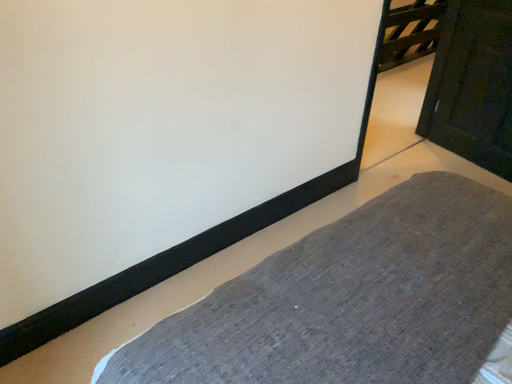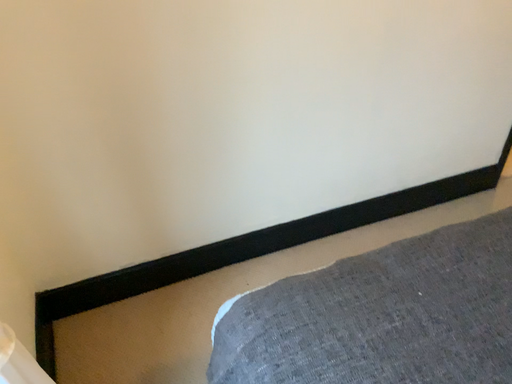
Question: How did the camera likely rotate when shooting the video?

Choices:
 (A) rotated right
 (B) rotated left

Answer: (B)